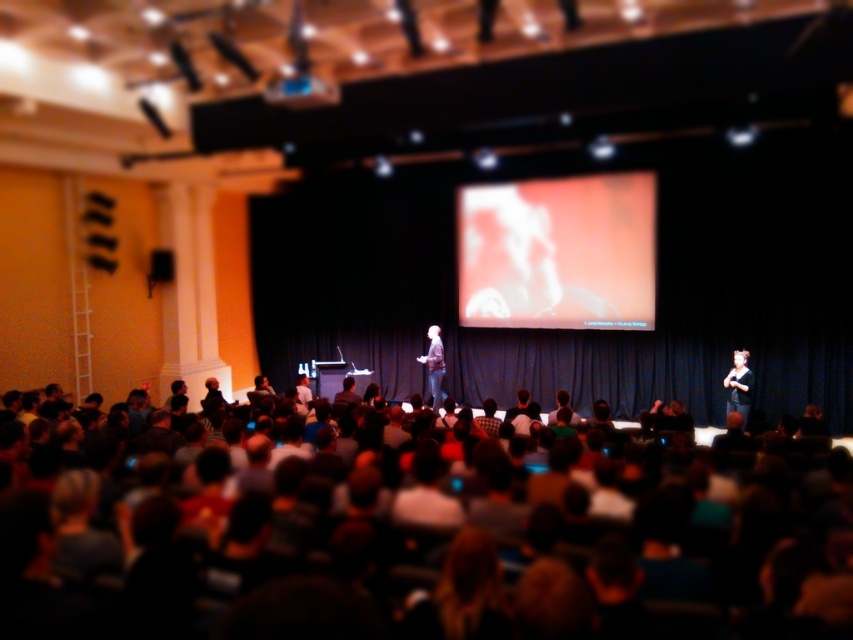
How distant is dark gray shirt at center from dark gray jacket at center?

3.98 meters

Which of these two, dark gray shirt at center or dark gray jacket at center, stands shorter?

With less height is dark gray shirt at center.

Who is more distant from viewer, (750, 372) or (416, 360)?

The point (416, 360) is more distant.

What are the coordinates of `dark gray shirt at center` in the screenshot? It's located at (740, 385).

Is blue plastic projector at upper center in front of dark gray shirt at center?

Yes, blue plastic projector at upper center is closer to the viewer.

Can you confirm if blue plastic projector at upper center is shorter than dark gray shirt at center?

Correct, blue plastic projector at upper center is not as tall as dark gray shirt at center.

Who is more forward, (x=329, y=99) or (x=734, y=392)?

Point (x=329, y=99) is more forward.

Locate an element on the screen. The image size is (853, 640). blue plastic projector at upper center is located at coordinates (300, 92).

Between orange matte screen at center and dark gray jacket at center, which one has less height?

dark gray jacket at center

Looking at this image, does orange matte screen at center have a lesser height compared to dark gray jacket at center?

No, orange matte screen at center is not shorter than dark gray jacket at center.

Between point (643, 228) and point (440, 400), which one is positioned in front?

Point (643, 228)

Find the location of a particular element. This screenshot has height=640, width=853. orange matte screen at center is located at coordinates (558, 252).